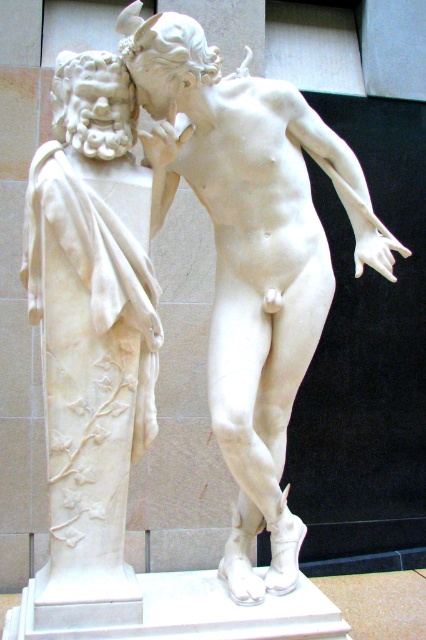
Question: In this image, where is white marble statue at center located relative to white marble statue at left?

Choices:
 (A) left
 (B) right

Answer: (B)

Question: Is white marble statue at center to the right of white marble statue at left from the viewer's perspective?

Choices:
 (A) no
 (B) yes

Answer: (B)

Question: Which point is farther from the camera taking this photo?

Choices:
 (A) (77, 364)
 (B) (301, 296)

Answer: (B)

Question: Is the position of white marble statue at center less distant than that of white marble statue at left?

Choices:
 (A) no
 (B) yes

Answer: (A)

Question: Which point appears farthest from the camera in this image?

Choices:
 (A) (241, 339)
 (B) (81, 576)

Answer: (A)